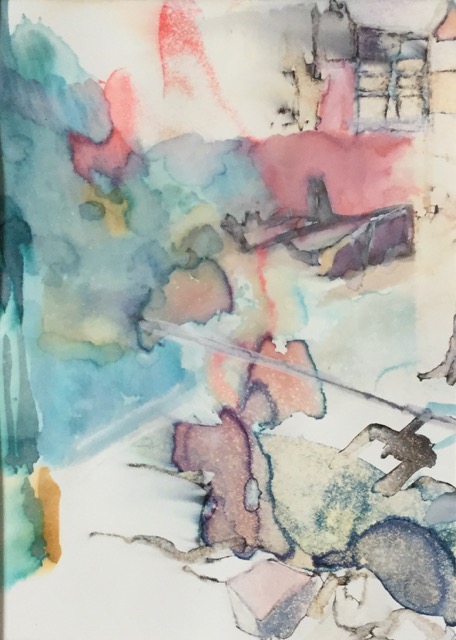
Where is `watercolor painting`? watercolor painting is located at coordinates (232, 253).